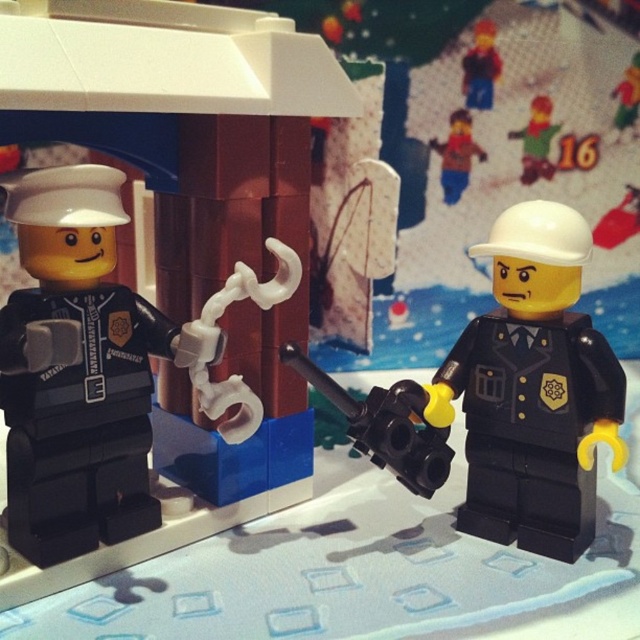
Question: Does matte brown figure at upper center have a greater width compared to green matte figure at upper right?

Choices:
 (A) no
 (B) yes

Answer: (B)

Question: Estimate the real-world distances between objects in this image. Which object is farther from the black plastic gun at center?

Choices:
 (A) matte black helmet at right
 (B) matte black police officer at left
 (C) smooth plastic toy at upper right

Answer: (C)

Question: Is matte black police officer at left thinner than black plastic gun at center?

Choices:
 (A) yes
 (B) no

Answer: (B)

Question: Which object is the closest to the black plastic gun at center?

Choices:
 (A) smooth plastic toy at upper right
 (B) matte brown figure at upper center
 (C) matte black police officer at left

Answer: (C)

Question: Which object is farther from the camera taking this photo?

Choices:
 (A) black plastic gun at center
 (B) matte black helmet at right
 (C) matte brown figure at upper center
 (D) smooth plastic toy at upper right

Answer: (D)

Question: Can you confirm if green matte figure at upper right is thinner than smooth plastic toy at upper right?

Choices:
 (A) yes
 (B) no

Answer: (B)